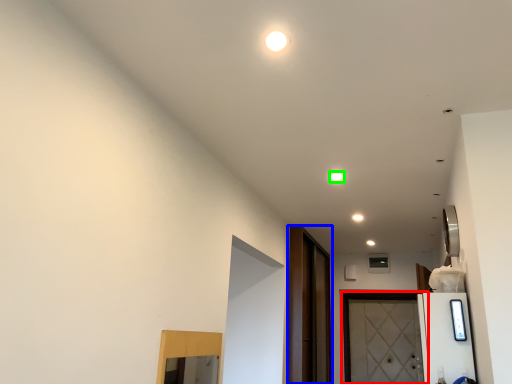
Question: Which object is the closest to the door (highlighted by a red box)? Choose among these: screen door (highlighted by a blue box) or light (highlighted by a green box).

Choices:
 (A) screen door
 (B) light

Answer: (A)